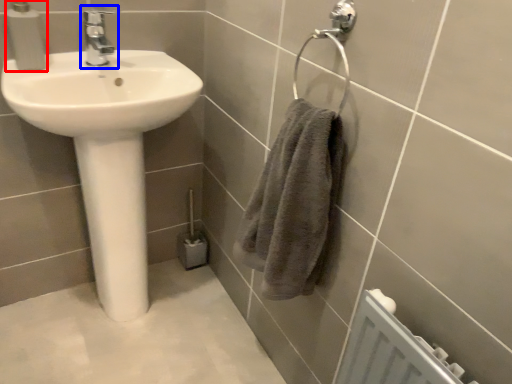
Question: Which object is closer to the camera taking this photo, soap dispenser (highlighted by a red box) or tap (highlighted by a blue box)?

Choices:
 (A) soap dispenser
 (B) tap

Answer: (A)